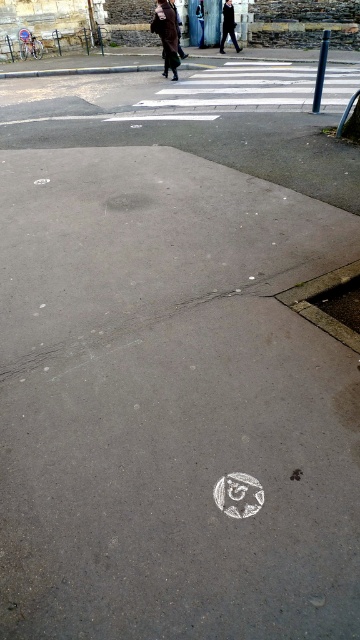
Question: Which point is farther from the camera taking this photo?

Choices:
 (A) [x=173, y=65]
 (B) [x=222, y=28]

Answer: (B)

Question: Where is brown wool coat at upper center located in relation to dark gray suit at center in the image?

Choices:
 (A) right
 (B) left

Answer: (B)

Question: Which of the following is the farthest from the observer?

Choices:
 (A) brown wool coat at upper center
 (B) dark gray suit at center

Answer: (B)

Question: Can you confirm if brown wool coat at upper center is positioned below dark gray suit at center?

Choices:
 (A) no
 (B) yes

Answer: (B)

Question: Does brown wool coat at upper center have a larger size compared to dark gray suit at center?

Choices:
 (A) no
 (B) yes

Answer: (B)